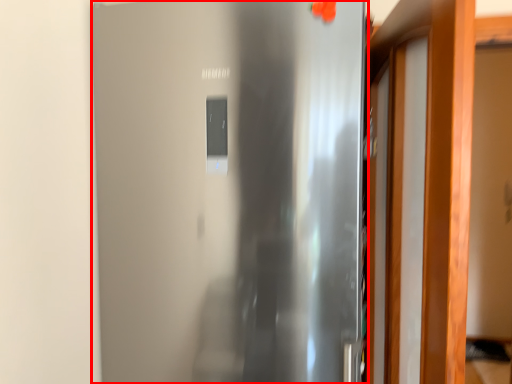
Question: From the image's perspective, what is the correct spatial relationship of door (annotated by the red box) in relation to door?

Choices:
 (A) below
 (B) above

Answer: (A)